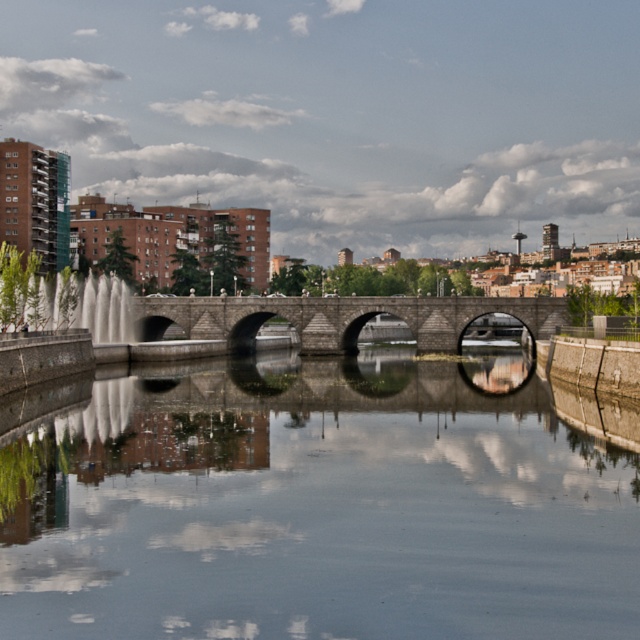
You are a tourist standing on the stone bridge at center and want to take a photo of the smooth concrete water at center. Since the bridge is above the water, where should you position yourself to capture the reflection of the bridge in the water?

The smooth concrete water at center is positioned under the stone bridge at center, so you should position yourself on the stone bridge at center to capture the reflection of the bridge in the water below.

You are a drone operator trying to capture the reflection of the stone bridge on the smooth concrete water at center. According to the scene description, where should you position the drone to ensure the reflection is fully visible in the photo?

The smooth concrete water at center is located at point (316, 508), so you should position the drone directly above that coordinate to capture the reflection of the stone bridge.